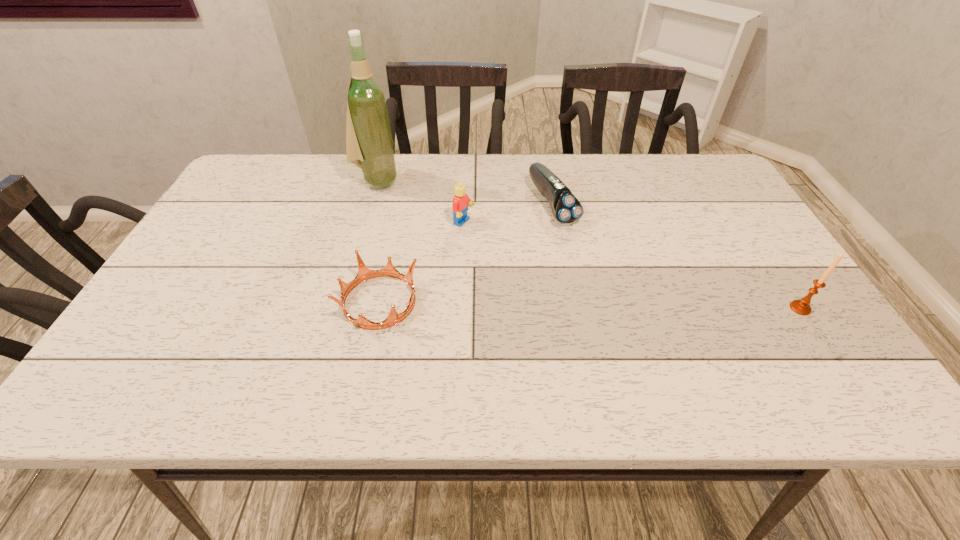
Locate an element on the screen. This screenshot has width=960, height=540. object that is positioned at the near edge is located at coordinates (364, 273).

At what (x,y) coordinates should I click in order to perform the action: click on object that is positioned at the right edge. Please return your answer as a coordinate pair (x, y). The width and height of the screenshot is (960, 540). Looking at the image, I should click on (801, 307).

Find the location of `vacant space at the far edge of the desktop`. vacant space at the far edge of the desktop is located at coordinates (656, 176).

What are the coordinates of `vacant space at the near edge of the desktop` in the screenshot? It's located at click(x=396, y=327).

This screenshot has width=960, height=540. I want to click on free space at the left edge of the desktop, so click(x=206, y=254).

At what (x,y) coordinates should I click in order to perform the action: click on vacant region at the right edge of the desktop. Please return your answer as a coordinate pair (x, y). Looking at the image, I should click on (718, 267).

Locate an element on the screen. vacant space at the far left corner is located at coordinates (225, 196).

You are a GUI agent. You are given a task and a screenshot of the screen. Output one action in this format:
    pyautogui.click(x=<x>, y=<y>)
    Task: Click on the free space at the far right corner of the desktop
    The image size is (960, 540).
    Given the screenshot: What is the action you would take?
    pyautogui.click(x=729, y=191)

Where is `vacant space at the near right corner of the desktop`? vacant space at the near right corner of the desktop is located at coordinates (756, 326).

Where is `empty space that is in between the crown and the Lego`? The image size is (960, 540). empty space that is in between the crown and the Lego is located at coordinates (421, 262).